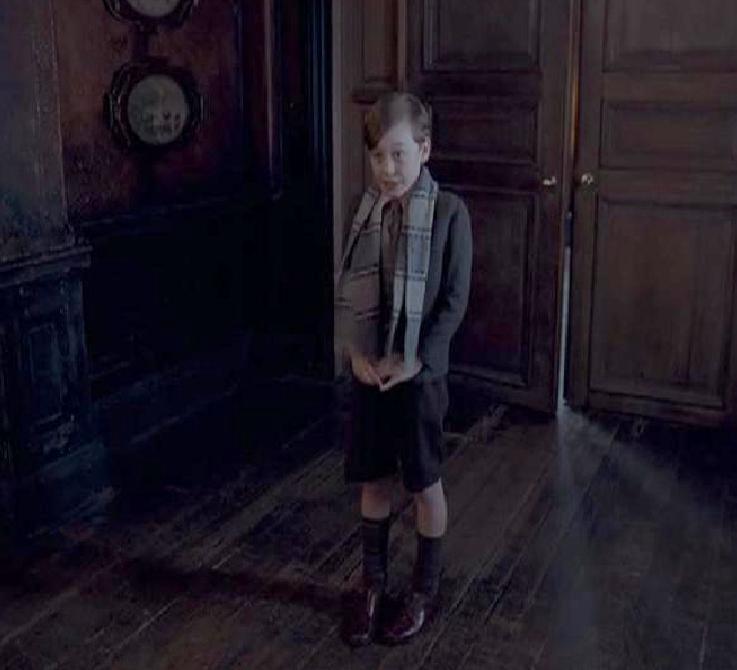
I want to click on doors, so click(491, 145), click(657, 178).